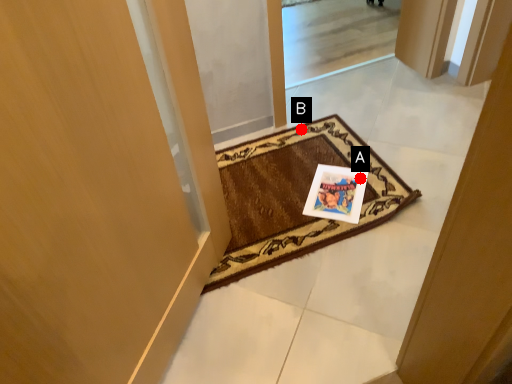
Question: Two points are circled on the image, labeled by A and B beside each circle. Which point is closer to the camera taking this photo?

Choices:
 (A) A is closer
 (B) B is closer

Answer: (A)